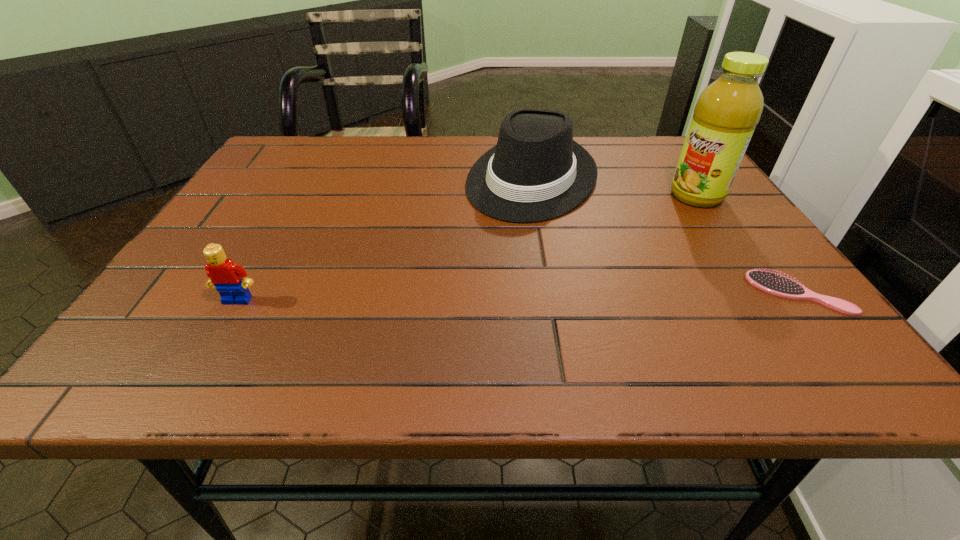
Where is `free space on the desktop that is between the leftmost object and the hairbrush and is positioned on the front-facing side of the third object from right to left`? free space on the desktop that is between the leftmost object and the hairbrush and is positioned on the front-facing side of the third object from right to left is located at coordinates (444, 298).

Locate an element on the screen. Image resolution: width=960 pixels, height=540 pixels. free spot on the desktop that is between the second shortest object and the hairbrush and is positioned on the front label of the fruit juice is located at coordinates (501, 296).